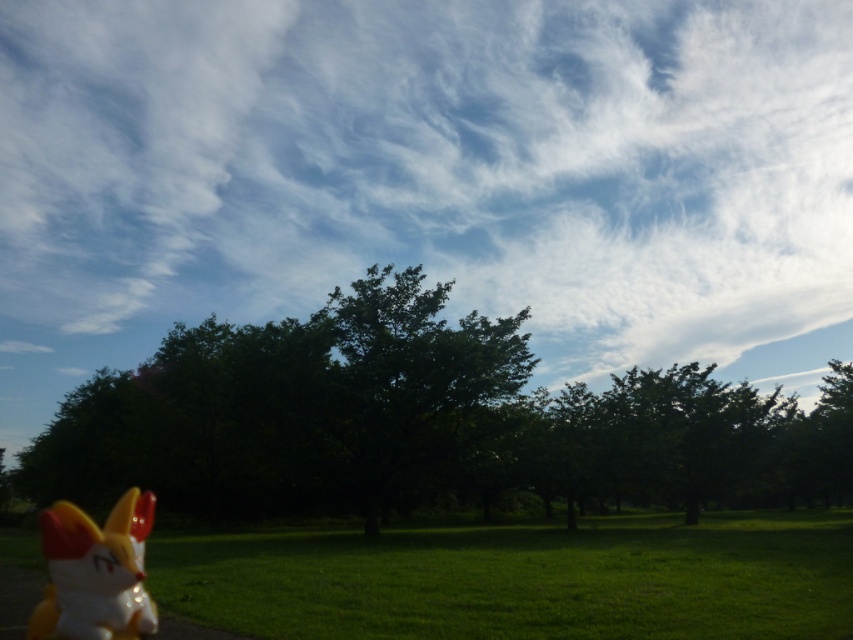
Question: Which point is closer to the camera taking this photo?

Choices:
 (A) (299, 381)
 (B) (129, 524)

Answer: (B)

Question: Which point appears farthest from the camera in this image?

Choices:
 (A) (641, 150)
 (B) (129, 563)

Answer: (A)

Question: In this image, where is white fluffy cloud at upper center located relative to shiny plastic fox at lower left?

Choices:
 (A) below
 (B) above

Answer: (B)

Question: Does white fluffy cloud at upper center come behind green leafy tree at center?

Choices:
 (A) no
 (B) yes

Answer: (B)

Question: Which is nearer to the green leafy tree at center?

Choices:
 (A) shiny plastic fox at lower left
 (B) white fluffy cloud at upper center

Answer: (A)

Question: Observing the image, what is the correct spatial positioning of green leafy tree at center in reference to shiny plastic fox at lower left?

Choices:
 (A) right
 (B) left

Answer: (A)